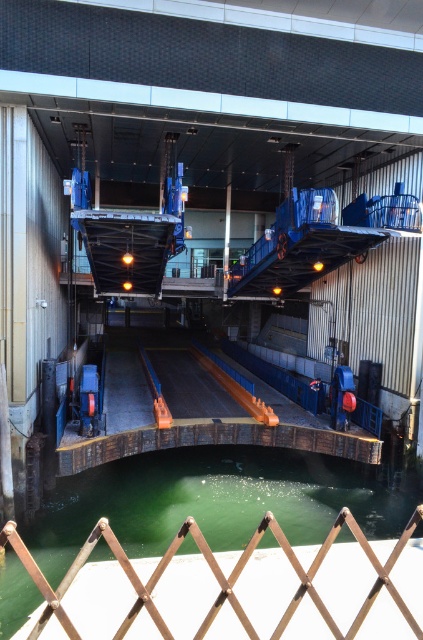
You are a maintenance worker needing to access the wooden dock at center for repairs. The brown wooden fence at lower center is blocking your path. Can you step over the fence to reach the dock?

The wooden dock at center is taller than the brown wooden fence at lower center, so yes, you can step over the brown wooden fence at lower center to reach the wooden dock at center since it is shorter in height.

You are a maintenance worker needing to inspect both the wooden dock at center and the brown wooden fence at lower center. Which object should you inspect first if you want to start from the highest point?

The wooden dock at center is above the brown wooden fence at lower center, so you should inspect the wooden dock at center first since it is higher up.